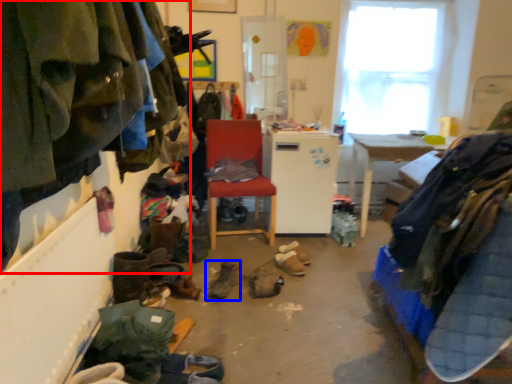
Question: Which object is closer to the camera taking this photo, clothing (highlighted by a red box) or footwear (highlighted by a blue box)?

Choices:
 (A) clothing
 (B) footwear

Answer: (A)